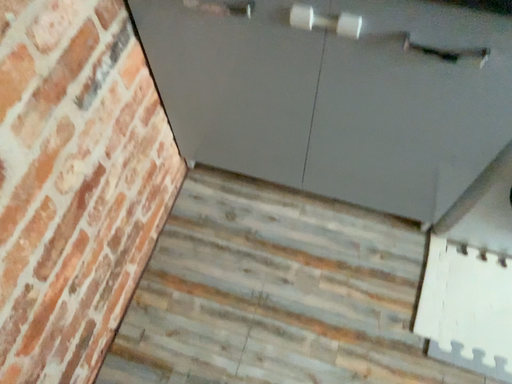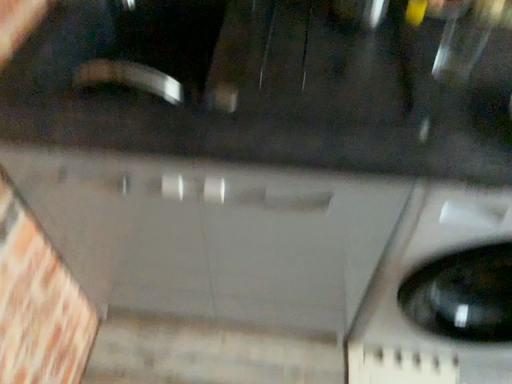
Question: Which way did the camera rotate in the video?

Choices:
 (A) rotated upward
 (B) rotated downward

Answer: (A)